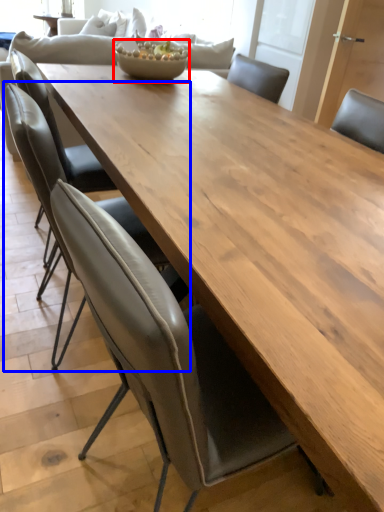
Question: Which point is closer to the camera, salad bowl (highlighted by a red box) or chair (highlighted by a blue box)?

Choices:
 (A) salad bowl
 (B) chair

Answer: (B)